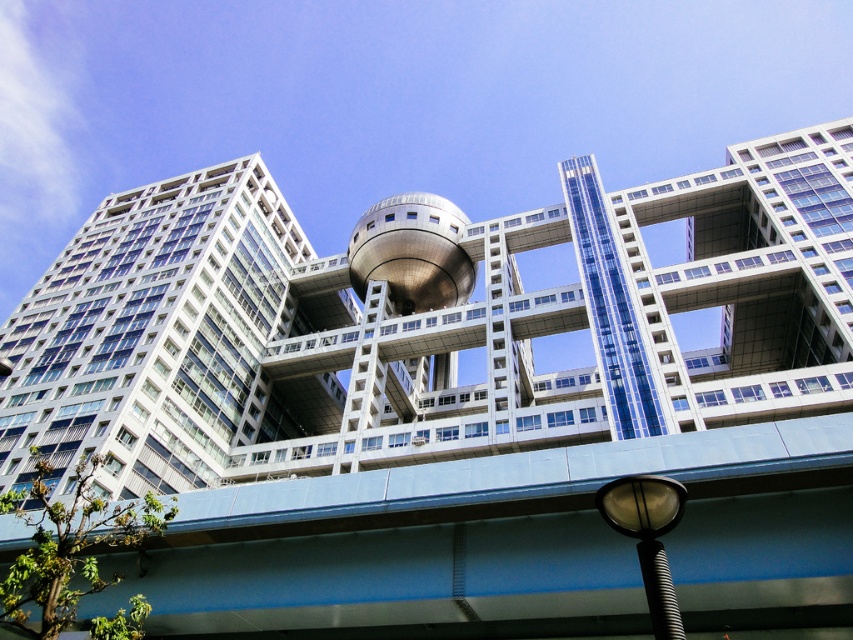
Does point (265, 604) come farther from viewer compared to point (451, 204)?

That is False.

Is blue concrete overpass at center to the left of sleek metallic sphere at center from the viewer's perspective?

No, blue concrete overpass at center is not to the left of sleek metallic sphere at center.

Is point (384, 614) positioned in front of point (432, 246)?

That is True.

Find the location of a particular element. blue concrete overpass at center is located at coordinates (511, 545).

Which is behind, point (396, 328) or point (389, 209)?

The point (389, 209) is behind.

Between metallic silver tower at center and sleek metallic sphere at center, which one has less height?

Standing shorter between the two is sleek metallic sphere at center.

Is point (592, 218) less distant than point (370, 221)?

Yes.

Identify the location of metallic silver tower at center. The width and height of the screenshot is (853, 640). pos(426,326).

Does white glass building at left have a greater height compared to sleek metallic sphere at center?

Indeed, white glass building at left has a greater height compared to sleek metallic sphere at center.

Who is shorter, white glass building at left or sleek metallic sphere at center?

Standing shorter between the two is sleek metallic sphere at center.

Between point (206, 326) and point (372, 230), which one is positioned behind?

The point (372, 230) is behind.

The image size is (853, 640). In order to click on white glass building at left in this screenshot , I will do `click(151, 333)`.